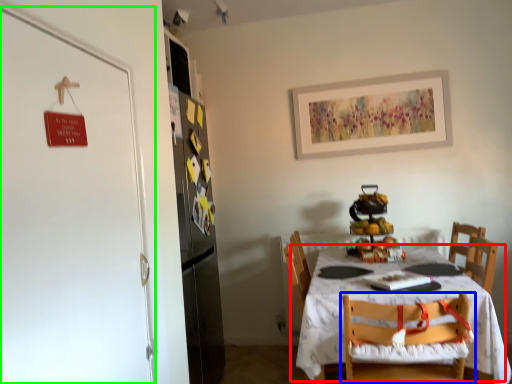
Question: Considering the real-world distances, which object is farthest from table (highlighted by a red box)? chair (highlighted by a blue box) or door (highlighted by a green box)?

Choices:
 (A) chair
 (B) door

Answer: (B)